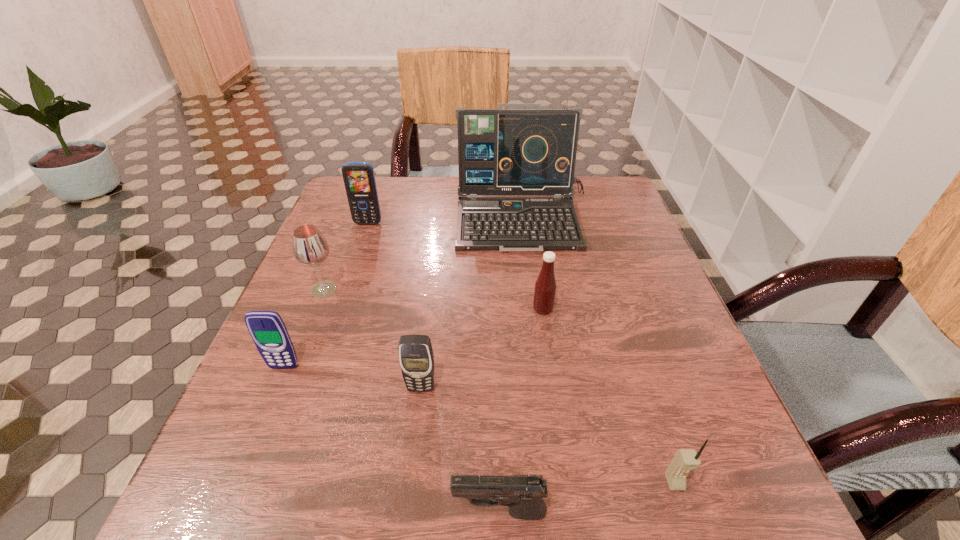
The image size is (960, 540). Identify the location of free space between the tallest object and the farthest cellular telephone. (445, 222).

This screenshot has height=540, width=960. In order to click on unoccupied area between the second farthest cellular telephone and the third farthest object in this screenshot , I will do `click(303, 328)`.

The width and height of the screenshot is (960, 540). I want to click on free space between the laptop computer and the sixth farthest object, so click(x=472, y=304).

This screenshot has height=540, width=960. In order to click on unoccupied position between the laptop computer and the second nearest object in this screenshot , I will do `click(599, 352)`.

The height and width of the screenshot is (540, 960). Identify the location of free spot between the tallest object and the nearest object. (512, 367).

Locate an element on the screen. The image size is (960, 540). free area in between the third nearest object and the farthest cellular telephone is located at coordinates (395, 306).

Where is `object identified as the fifth closest to the tallest cellular telephone`? Image resolution: width=960 pixels, height=540 pixels. object identified as the fifth closest to the tallest cellular telephone is located at coordinates (416, 357).

In order to click on object that ranks as the fourth closest to the shortest object in this screenshot , I will do `click(267, 329)`.

You are a GUI agent. You are given a task and a screenshot of the screen. Output one action in this format:
    pyautogui.click(x=<x>, y=<y>)
    Task: Click on the cellular telephone object that ranks as the third closest to the fourth nearest object
    The image size is (960, 540).
    Given the screenshot: What is the action you would take?
    pyautogui.click(x=685, y=460)

The height and width of the screenshot is (540, 960). Find the location of `cellular telephone that is the second closest to the nearest cellular telephone`. cellular telephone that is the second closest to the nearest cellular telephone is located at coordinates (267, 329).